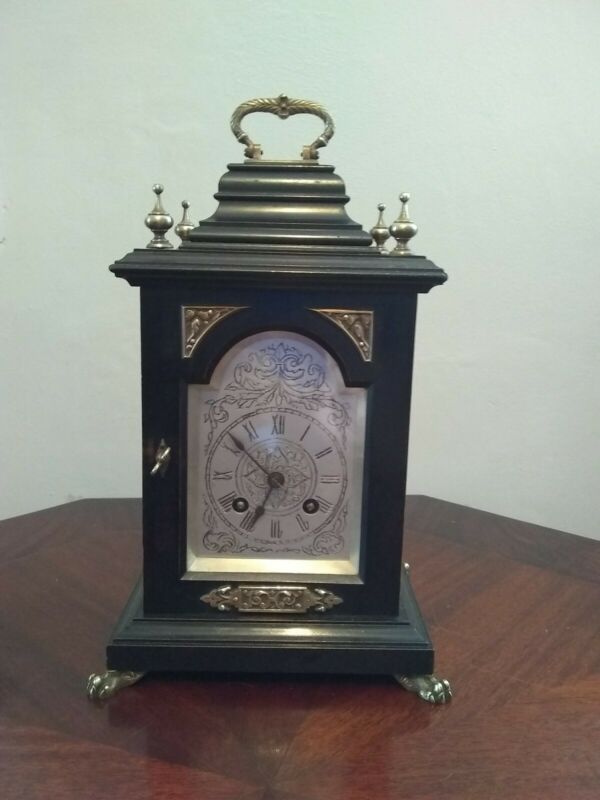
At what (x,y) coordinates should I click in order to perform the action: click on screws. Please return your answer as a coordinate pair (x, y). Looking at the image, I should click on (240, 504), (310, 506).